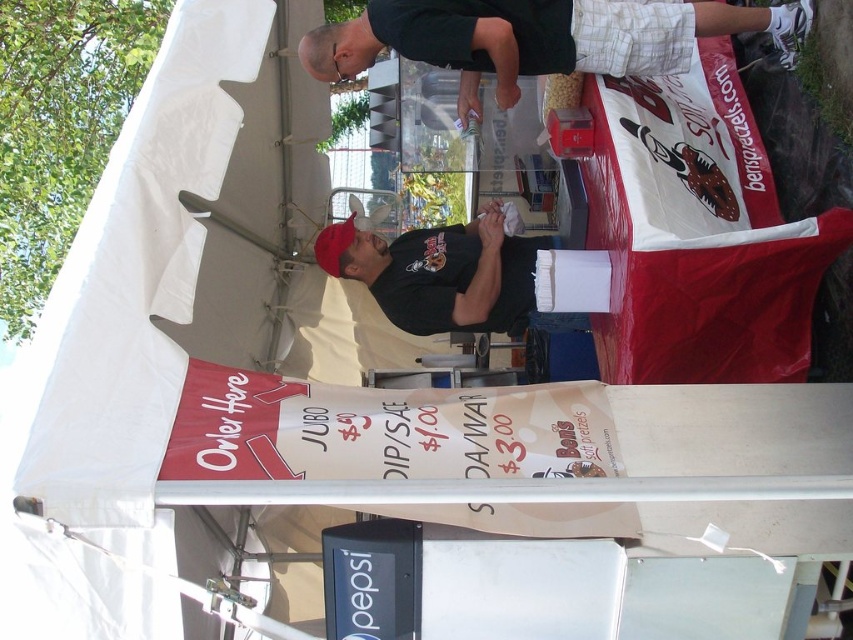
Question: Among these objects, which one is farthest from the camera?

Choices:
 (A) black shirt at upper center
 (B) black matte shirt at center

Answer: (B)

Question: Is black shirt at upper center positioned at the back of black matte shirt at center?

Choices:
 (A) no
 (B) yes

Answer: (A)

Question: Observing the image, what is the correct spatial positioning of black shirt at upper center in reference to black matte shirt at center?

Choices:
 (A) right
 (B) left

Answer: (A)

Question: Is black shirt at upper center below black matte shirt at center?

Choices:
 (A) yes
 (B) no

Answer: (B)